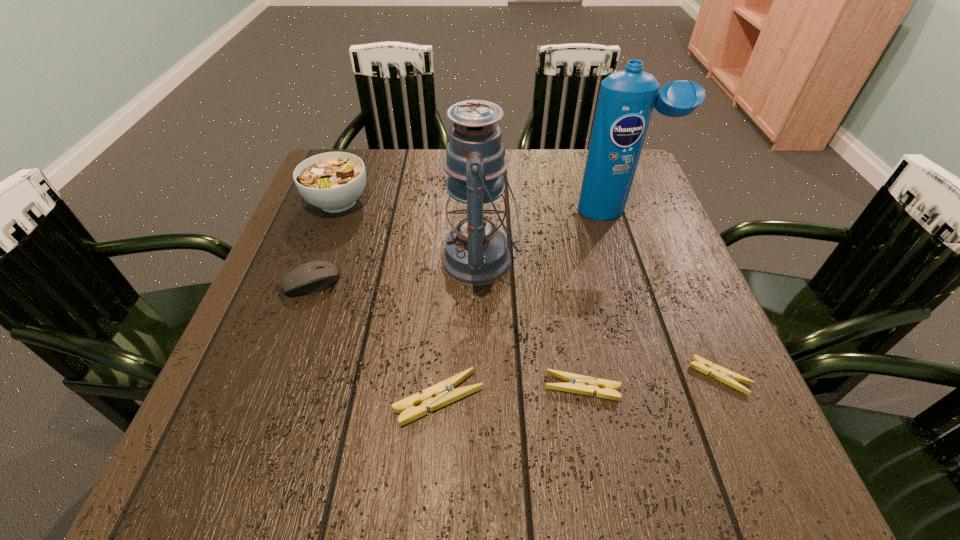
The image size is (960, 540). In order to click on vacant space situated on the back of the leftmost clothespin in this screenshot , I will do tap(448, 262).

I want to click on vacant space situated 0.380m on the left of the second clothespin from right to left, so click(x=324, y=387).

At what (x,y) coordinates should I click in order to perform the action: click on blank space located on the left of the rightmost clothespin. Please return your answer as a coordinate pair (x, y). This screenshot has height=540, width=960. Looking at the image, I should click on (481, 376).

The width and height of the screenshot is (960, 540). I want to click on vacant area situated on the front of the fifth shortest object, so click(x=308, y=282).

Locate an element on the screen. This screenshot has height=540, width=960. vacant space located on the back of the shampoo is located at coordinates (598, 154).

Where is `vacant position located on the right of the computer equipment`? vacant position located on the right of the computer equipment is located at coordinates (391, 282).

What are the coordinates of `free point located on the front-facing side of the lantern` in the screenshot? It's located at (396, 261).

The image size is (960, 540). Identify the location of vacant space positioned on the front-facing side of the lantern. (338, 261).

Where is `vacant space located 0.060m on the front-facing side of the lantern`? Image resolution: width=960 pixels, height=540 pixels. vacant space located 0.060m on the front-facing side of the lantern is located at coordinates (415, 261).

You are a GUI agent. You are given a task and a screenshot of the screen. Output one action in this format:
    pyautogui.click(x=<x>, y=<y>)
    Task: Click on the object that is at the far edge
    
    Given the screenshot: What is the action you would take?
    pyautogui.click(x=333, y=181)